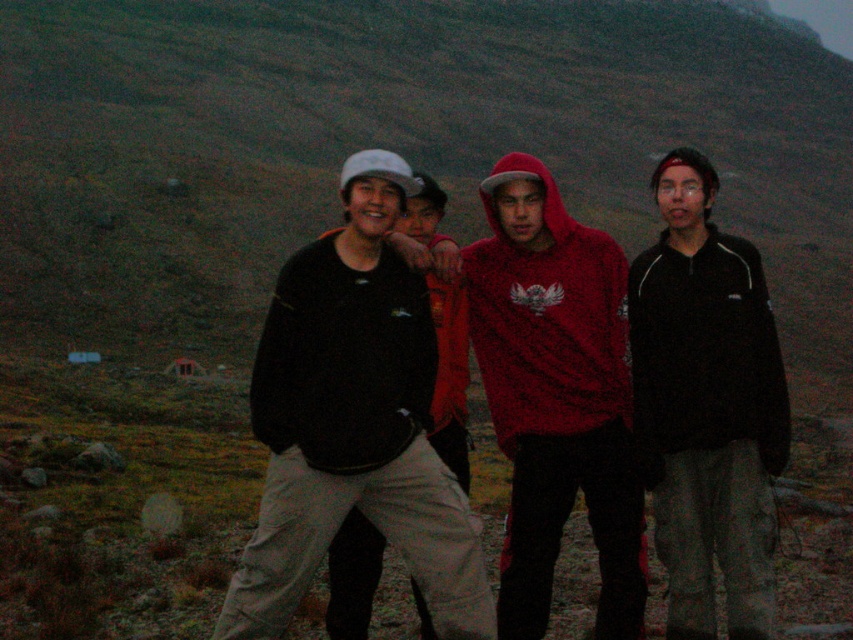
You are planning to take a photo of the group, and you need to ensure that both the black fleece jacket at right and the matte black jacket at center are visible. Given their sizes, which jacket might require you to adjust your camera angle to avoid being blocked by others?

The black fleece jacket at right is narrower than the matte black jacket at center, so the narrower black fleece jacket at right might be more easily blocked by others if positioned at the edge, requiring an adjustment to ensure visibility.

You are planning to take a group photo of the red hoodie at center and the black fleece jacket at right. Based on their sizes, which person should stand closer to the camera to ensure both appear equally sized in the photo?

The black fleece jacket at right should stand closer to the camera because the red hoodie at center is wider than the black fleece jacket at right, so moving the narrower one closer will balance their apparent sizes.

You are part of a hiking group and need to identify two people at the center of the image. Which one is positioned to the left between the matte black shirt at center and the matte black jacket at center?

The matte black shirt at center is positioned to the left of the matte black jacket at center.